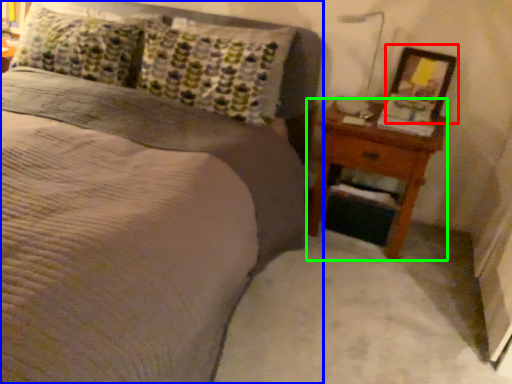
Question: Based on their relative distances, which object is farther from picture frame (highlighted by a red box)? Choose from bed (highlighted by a blue box) and nightstand (highlighted by a green box).

Choices:
 (A) bed
 (B) nightstand

Answer: (A)